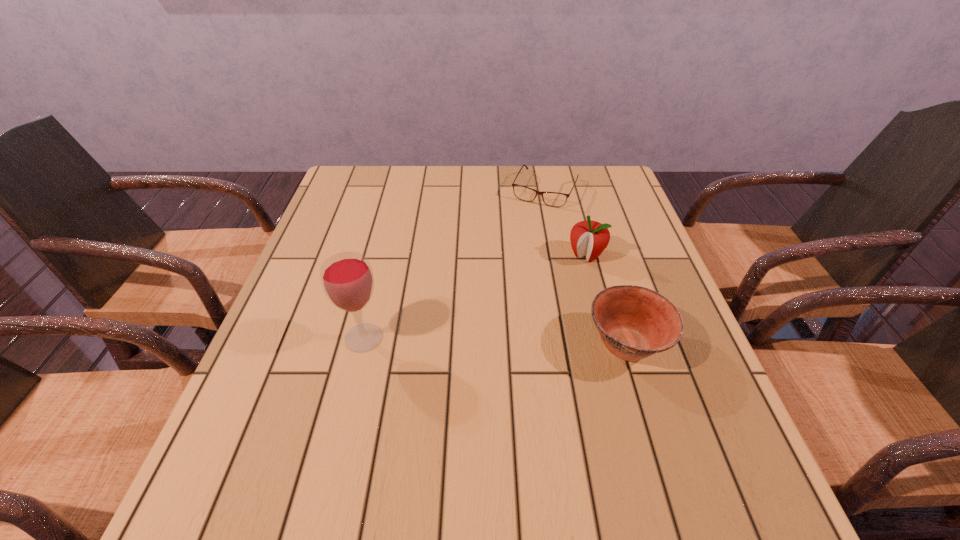
I want to click on the tallest object, so click(x=347, y=279).

At what (x,y) coordinates should I click in order to perform the action: click on the leftmost object. Please return your answer as a coordinate pair (x, y). The height and width of the screenshot is (540, 960). Looking at the image, I should click on (347, 279).

Identify the location of the third tallest object. (634, 322).

Locate an element on the screen. This screenshot has width=960, height=540. the second tallest object is located at coordinates [588, 238].

This screenshot has height=540, width=960. In order to click on the second farthest object in this screenshot , I will do `click(588, 238)`.

I want to click on the farthest object, so click(x=554, y=199).

Find the location of `the shortest object`. the shortest object is located at coordinates (554, 199).

The image size is (960, 540). I want to click on free space located on the back of the wineglass, so click(385, 253).

Find the location of a particular element. The image size is (960, 540). free spot located 0.080m on the left of the bowl is located at coordinates (547, 345).

Locate an element on the screen. Image resolution: width=960 pixels, height=540 pixels. vacant region located on the side where a bite is taken out of the second farthest object is located at coordinates (561, 288).